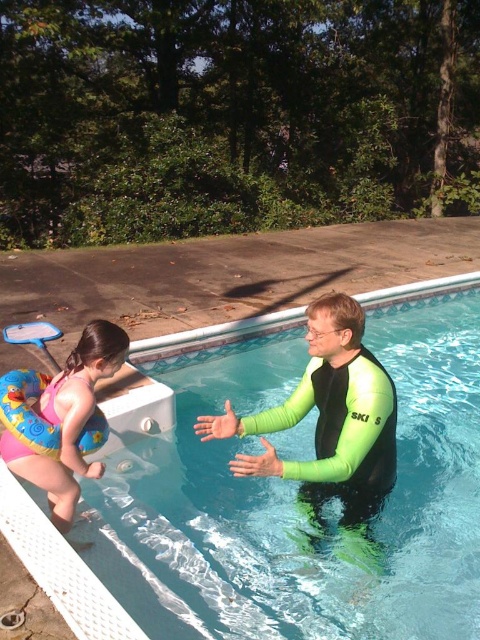
Question: Is green neoprene wetsuit at center positioned behind clear blue water at center?

Choices:
 (A) no
 (B) yes

Answer: (A)

Question: Which point is closer to the camera?

Choices:
 (A) clear blue water at center
 (B) green neoprene wetsuit at center
 (C) pink rubber ring at lower left

Answer: (B)

Question: Considering the real-world distances, which object is closest to the pink rubber ring at lower left?

Choices:
 (A) green neoprene wetsuit at center
 (B) clear blue water at center

Answer: (A)

Question: Where is clear blue water at center located in relation to pink rubber ring at lower left in the image?

Choices:
 (A) above
 (B) below

Answer: (A)

Question: Is green neoprene wetsuit at center closer to the viewer compared to clear blue water at center?

Choices:
 (A) yes
 (B) no

Answer: (A)

Question: Which point is farther from the camera taking this photo?

Choices:
 (A) (345, 429)
 (B) (143, 634)

Answer: (A)